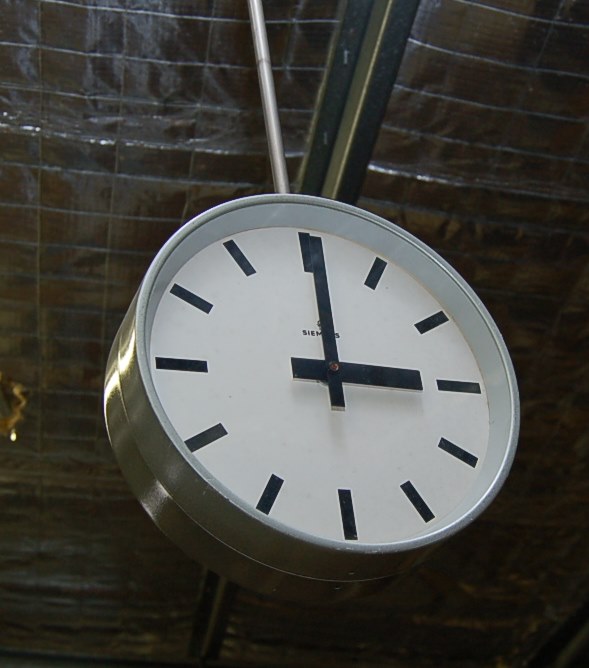
The image size is (589, 668). What are the coordinates of `seam around frame` in the screenshot? It's located at (240, 550).